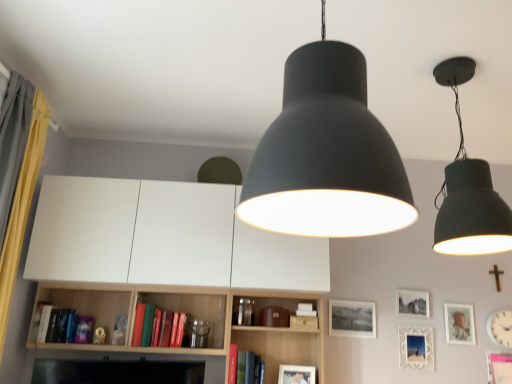
Question: From a real-world perspective, is matte gold picture frame at upper right, placed as the first picture frame when sorted from right to left, physically located above or below yellow fabric curtain at left?

Choices:
 (A) above
 (B) below

Answer: (B)

Question: From their relative heights in the image, would you say matte gold picture frame at upper right, the 5th picture frame positioned from the left, is taller or shorter than yellow fabric curtain at left?

Choices:
 (A) short
 (B) tall

Answer: (A)

Question: Estimate the real-world distances between objects in this image. Which object is closer to the matte black picture frame at center, which appears as the 2th picture frame when viewed from the left?

Choices:
 (A) white plastic clock at lower right
 (B) matte gold picture frame at upper right, the 5th picture frame positioned from the left
 (C) wooden cross at upper right
 (D) yellow fabric curtain at left
 (E) matte black lampshade at center, the 1th lamp in the front-to-back sequence

Answer: (B)

Question: Considering the real-world distances, which object is closest to the matte black lampshade at center, which appears as the 2th lamp when viewed from the back?

Choices:
 (A) matte black picture frame at center, positioned as the 4th picture frame in right-to-left order
 (B) white textured picture frame at lower right, the third picture frame positioned from the left
 (C) hardcover book at lower left, the second book positioned from the right
 (D) matte black picture frame at center-right, which is the second picture frame from right to left
 (E) yellow fabric curtain at left

Answer: (E)